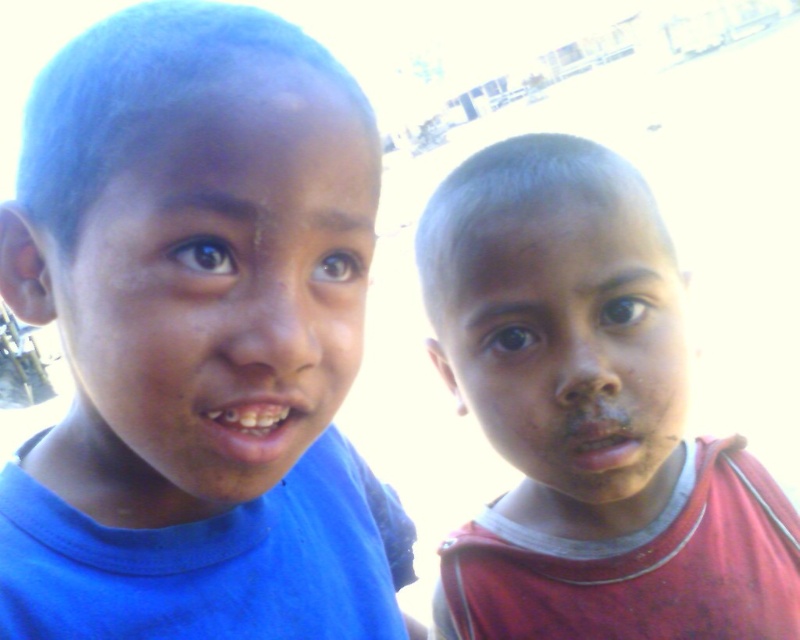
Does blue matte face at left have a lesser height compared to dull skin face at right?

Yes.

Is blue matte face at left further to the viewer compared to dull skin face at right?

No.

You are a GUI agent. You are given a task and a screenshot of the screen. Output one action in this format:
    pyautogui.click(x=<x>, y=<y>)
    Task: Click on the blue matte face at left
    
    Given the screenshot: What is the action you would take?
    pyautogui.click(x=214, y=301)

Does matte red shirt at right have a greater width compared to dull skin face at right?

Indeed, matte red shirt at right has a greater width compared to dull skin face at right.

At what (x,y) coordinates should I click in order to perform the action: click on matte red shirt at right. Please return your answer as a coordinate pair (x, y). The width and height of the screenshot is (800, 640). Looking at the image, I should click on (588, 416).

Consider the image. Which is more to the left, blue matte shirt at left or matte red shirt at right?

blue matte shirt at left is more to the left.

Who is more distant from viewer, (212, 588) or (541, 160)?

The point (541, 160) is behind.

This screenshot has height=640, width=800. I want to click on blue matte shirt at left, so click(197, 339).